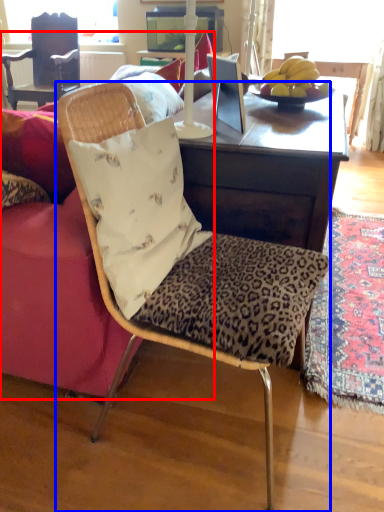
Question: Which of the following is the closest to the observer, studio couch (highlighted by a red box) or chair (highlighted by a blue box)?

Choices:
 (A) studio couch
 (B) chair

Answer: (B)